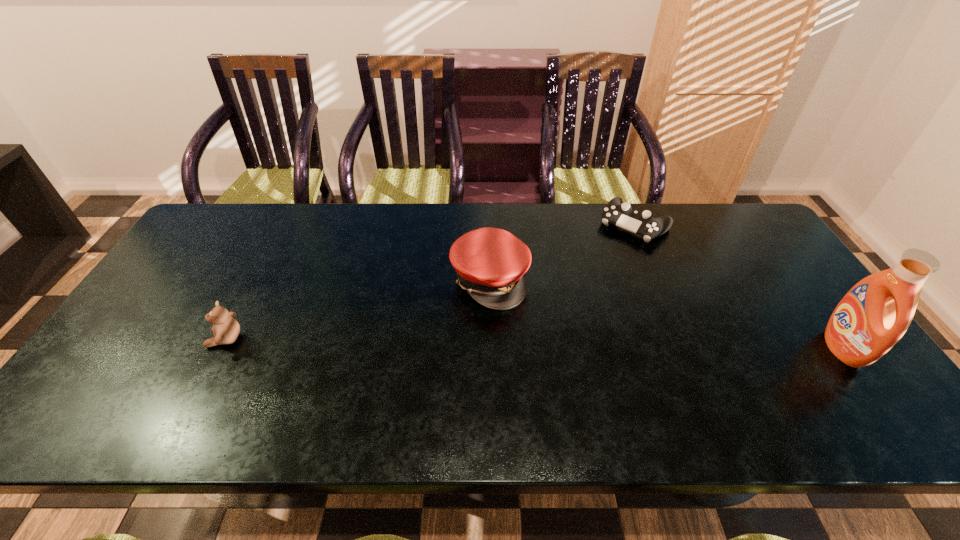
Where is `vacant space on the desktop that is between the leftmost object and the detergent and is positioned on the front of the third object from right to left with an emblem`? Image resolution: width=960 pixels, height=540 pixels. vacant space on the desktop that is between the leftmost object and the detergent and is positioned on the front of the third object from right to left with an emblem is located at coordinates (592, 345).

Identify the location of vacant space on the desktop that is between the teddy bear and the rightmost object and is positioned on the surface of the third object from left to right. (532, 343).